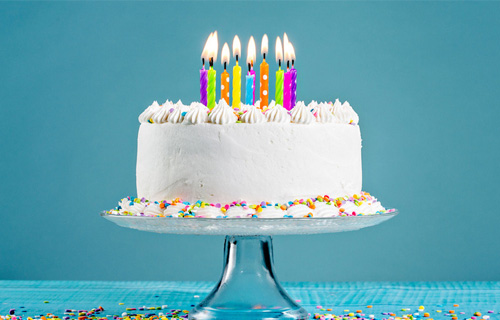
The width and height of the screenshot is (500, 320). In order to click on birthday candle flames in this screenshot , I will do [202, 50], [213, 49], [223, 53], [238, 50], [251, 52], [263, 50], [279, 54], [287, 53], [292, 54].